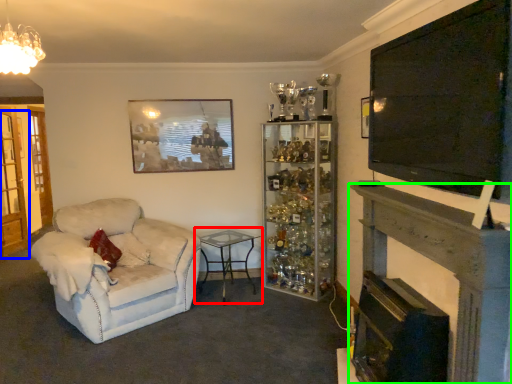
Question: Which object is positioned farthest from table (highlighted by a red box)? Select from glass door (highlighted by a blue box) and fireplace (highlighted by a green box).

Choices:
 (A) glass door
 (B) fireplace

Answer: (A)